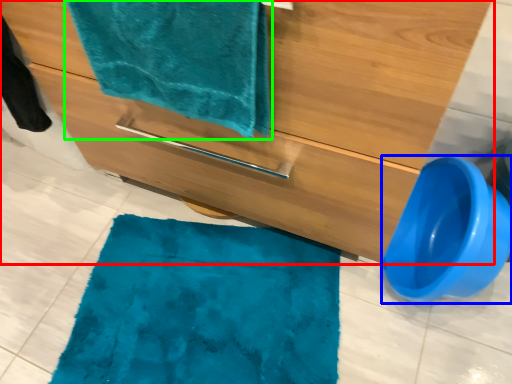
Question: Which is nearer to the bathroom cabinet (highlighted by a red box)? toilet bowl (highlighted by a blue box) or towel (highlighted by a green box).

Choices:
 (A) toilet bowl
 (B) towel

Answer: (B)